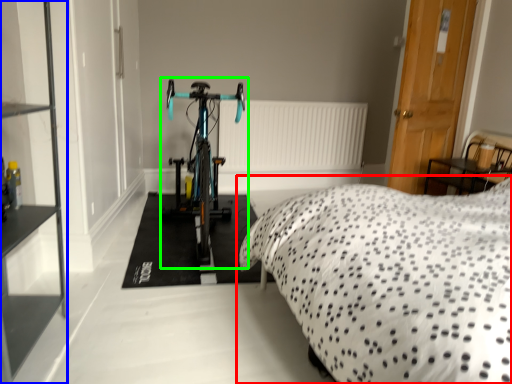
Question: Which object is the closest to the bed (highlighted by a red box)? Choose among these: shelf (highlighted by a blue box) or bicycle (highlighted by a green box).

Choices:
 (A) shelf
 (B) bicycle

Answer: (B)